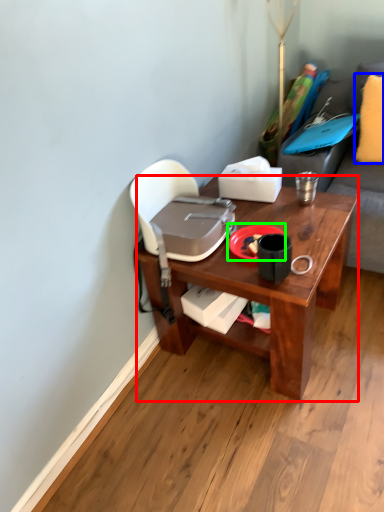
Question: Estimate the real-world distances between objects in this image. Which object is closer to desk (highlighted by a red box), pillow (highlighted by a blue box) or plate (highlighted by a green box)?

Choices:
 (A) pillow
 (B) plate

Answer: (B)